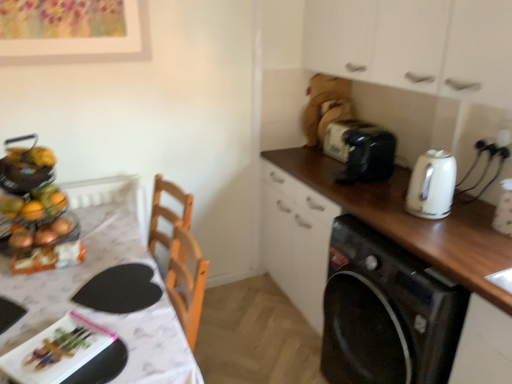
The height and width of the screenshot is (384, 512). In order to click on free spot above white glossy table at left (from a real-world perspective) in this screenshot , I will do `click(79, 281)`.